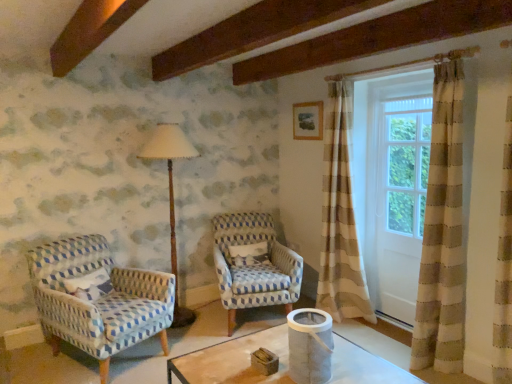
Question: Is wooden picture frame at upper center next to white fabric curtain at right?

Choices:
 (A) yes
 (B) no

Answer: (B)

Question: Can you confirm if wooden picture frame at upper center is positioned to the left of white fabric curtain at right?

Choices:
 (A) yes
 (B) no

Answer: (A)

Question: From the image's perspective, does wooden picture frame at upper center appear higher than white fabric curtain at right?

Choices:
 (A) no
 (B) yes

Answer: (B)

Question: Is white fabric curtain at right surrounded by wooden picture frame at upper center?

Choices:
 (A) yes
 (B) no

Answer: (B)

Question: Considering the relative sizes of wooden picture frame at upper center and white fabric curtain at right in the image provided, is wooden picture frame at upper center smaller than white fabric curtain at right?

Choices:
 (A) yes
 (B) no

Answer: (A)

Question: Considering the relative positions of blue and white woven chair at center, arranged as the 1th chair when viewed from the right, and blue-patterned fabric chair at left, acting as the 2th chair starting from the right, in the image provided, is blue and white woven chair at center, arranged as the 1th chair when viewed from the right, to the left or to the right of blue-patterned fabric chair at left, acting as the 2th chair starting from the right,?

Choices:
 (A) right
 (B) left

Answer: (A)

Question: Is point [245, 236] closer or farther from the camera than point [102, 327]?

Choices:
 (A) farther
 (B) closer

Answer: (A)

Question: Is blue and white woven chair at center, arranged as the 1th chair when viewed from the right, wider or thinner than blue-patterned fabric chair at left, marked as the 1th chair in a left-to-right arrangement?

Choices:
 (A) wide
 (B) thin

Answer: (B)

Question: Is blue and white woven chair at center, arranged as the 1th chair when viewed from the right, bigger or smaller than blue-patterned fabric chair at left, marked as the 1th chair in a left-to-right arrangement?

Choices:
 (A) small
 (B) big

Answer: (A)

Question: Considering their positions, is white fabric curtain at right located in front of or behind blue-patterned fabric chair at left, acting as the 2th chair starting from the right?

Choices:
 (A) behind
 (B) front

Answer: (A)

Question: From a real-world perspective, relative to blue-patterned fabric chair at left, acting as the 2th chair starting from the right, is white fabric curtain at right vertically above or below?

Choices:
 (A) above
 (B) below

Answer: (A)

Question: Is white fabric curtain at right wider or thinner than blue-patterned fabric chair at left, acting as the 2th chair starting from the right?

Choices:
 (A) thin
 (B) wide

Answer: (A)

Question: Would you say white fabric curtain at right is to the left or to the right of blue-patterned fabric chair at left, marked as the 1th chair in a left-to-right arrangement, in the picture?

Choices:
 (A) right
 (B) left

Answer: (A)

Question: Does point (416, 77) appear closer or farther from the camera than point (53, 337)?

Choices:
 (A) closer
 (B) farther

Answer: (A)

Question: In terms of width, does white wood screen door at right look wider or thinner when compared to blue-patterned fabric chair at left, marked as the 1th chair in a left-to-right arrangement?

Choices:
 (A) wide
 (B) thin

Answer: (B)